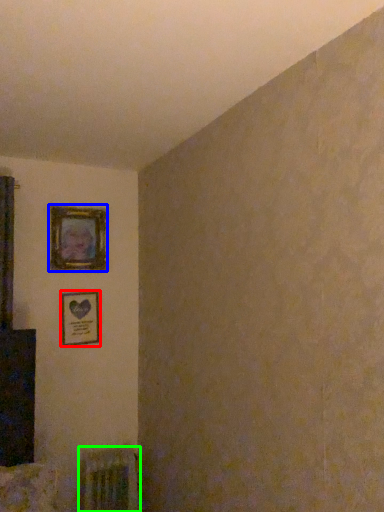
Question: Estimate the real-world distances between objects in this image. Which object is farther from picture frame (highlighted by a red box), picture frame (highlighted by a blue box) or radiator (highlighted by a green box)?

Choices:
 (A) picture frame
 (B) radiator

Answer: (B)